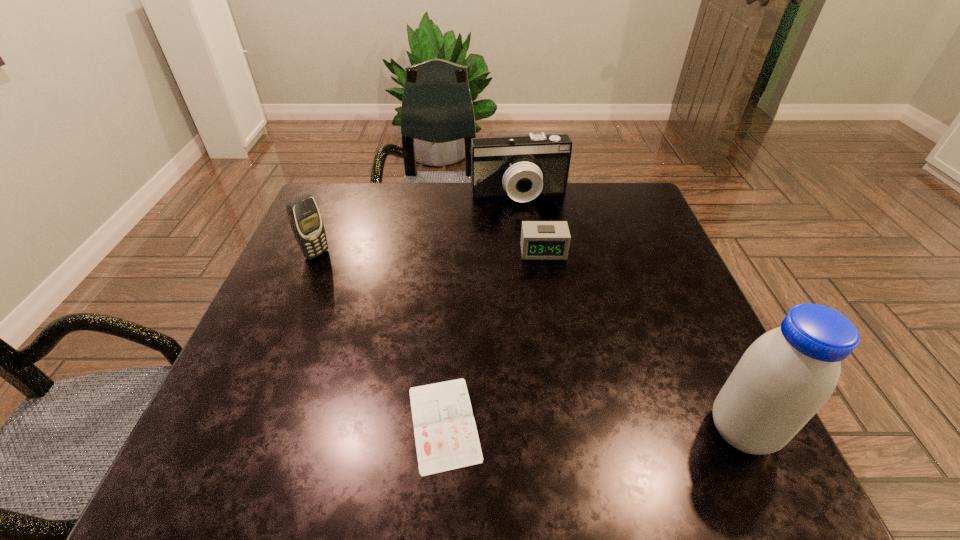
You are a GUI agent. You are given a task and a screenshot of the screen. Output one action in this format:
    pyautogui.click(x=<x>, y=<y>)
    Task: Click on the free location located on the front-facing side of the fourth tallest object
    The height and width of the screenshot is (540, 960).
    Given the screenshot: What is the action you would take?
    pyautogui.click(x=564, y=380)

This screenshot has width=960, height=540. Identify the location of vacant area situated on the lens of the camcorder. (541, 264).

What are the coordinates of `free point located on the lens of the camcorder` in the screenshot? It's located at (536, 244).

What are the coordinates of `blank area located 0.340m on the lens of the camcorder` in the screenshot? It's located at (551, 292).

I want to click on vacant space positioned on the front face of the cellular telephone, so coord(374,291).

The width and height of the screenshot is (960, 540). I want to click on free location located 0.220m on the front face of the cellular telephone, so click(x=386, y=298).

Locate an element on the screen. The width and height of the screenshot is (960, 540). vacant space located 0.080m on the front face of the cellular telephone is located at coordinates (346, 273).

Where is `object at the far edge`? object at the far edge is located at coordinates (522, 167).

At what (x,y) coordinates should I click in order to perform the action: click on diary located at the near edge. Please return your answer as a coordinate pair (x, y). The height and width of the screenshot is (540, 960). Looking at the image, I should click on (446, 437).

Locate an element on the screen. This screenshot has height=540, width=960. soya milk present at the near edge is located at coordinates (784, 378).